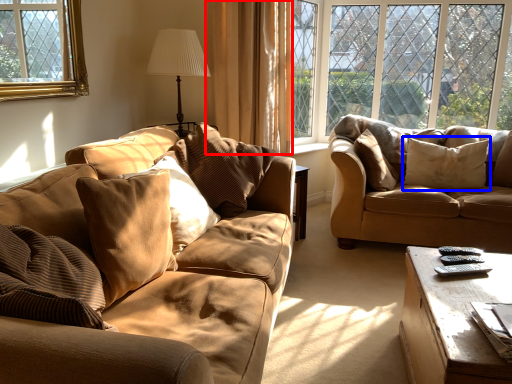
Question: Which point is closer to the camera, curtain (highlighted by a red box) or pillow (highlighted by a blue box)?

Choices:
 (A) curtain
 (B) pillow

Answer: (A)